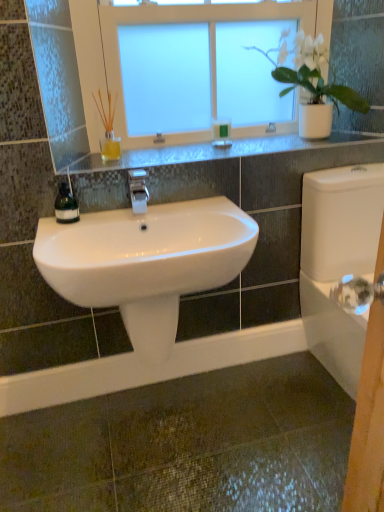
This screenshot has height=512, width=384. Identify the location of empty space that is to the right of green matte soap dispenser at left. (109, 212).